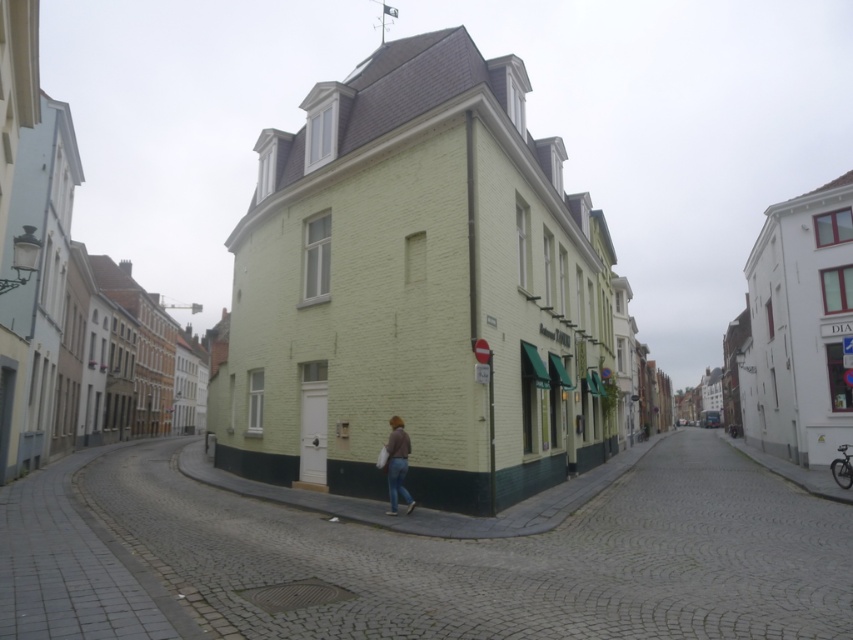
Does smooth cobblestone alley at center have a greater width compared to denim pants at center?

Correct, the width of smooth cobblestone alley at center exceeds that of denim pants at center.

Does point (345, 624) lie behind point (392, 454)?

No.

At what (x,y) coordinates should I click in order to perform the action: click on smooth cobblestone alley at center. Please return your answer as a coordinate pair (x, y). Looking at the image, I should click on (424, 560).